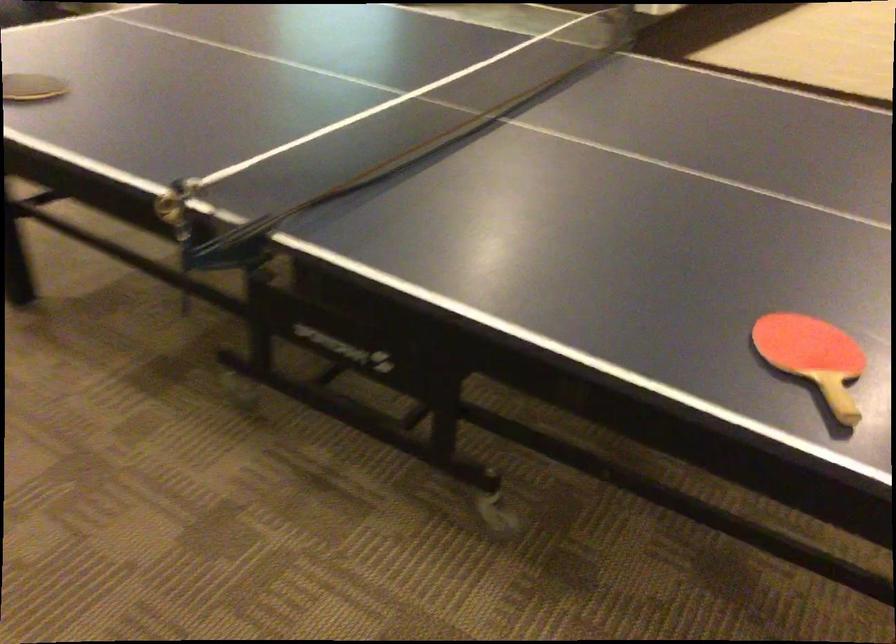
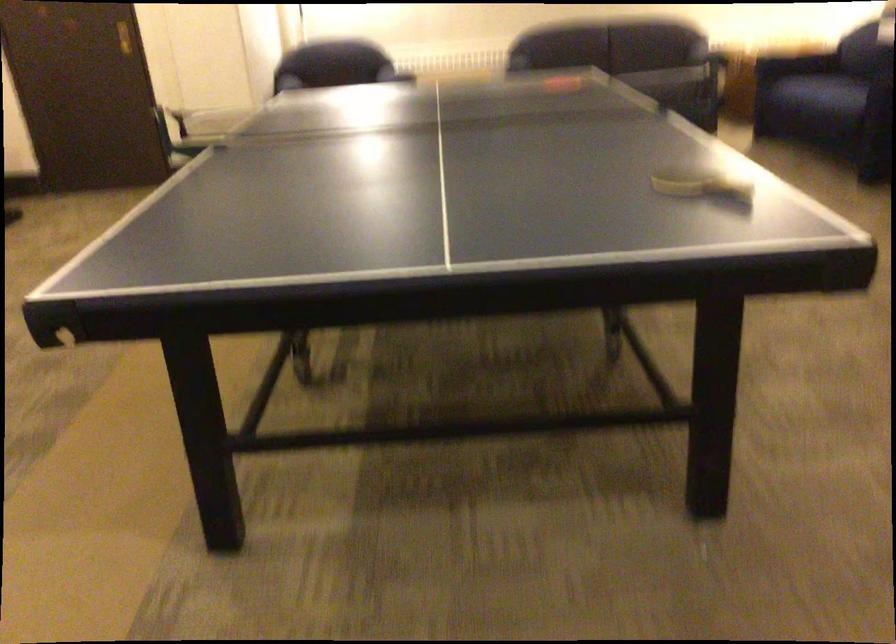
Question: I am providing you with two images of the same scene from different viewpoints. After the viewpoint changes to image2, which objects are now occluded?

Choices:
 (A) ping-pong paddle
 (B) sofa armrest
 (C) red ping pong paddle
 (D) blue mattress edge

Answer: (C)